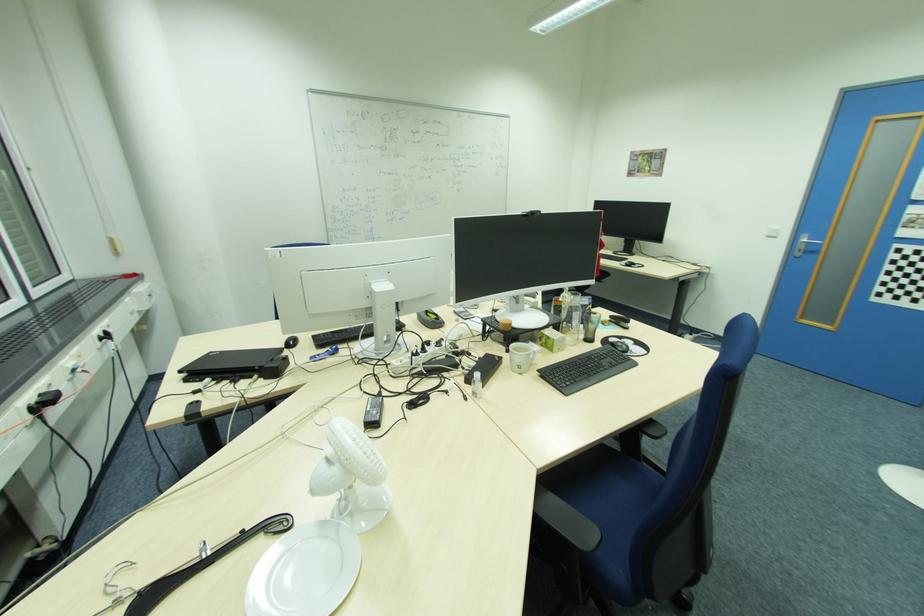
Find where to resting arm the chair armrest. Please return your answer as a coordinate pair (x, y).

(565, 521)